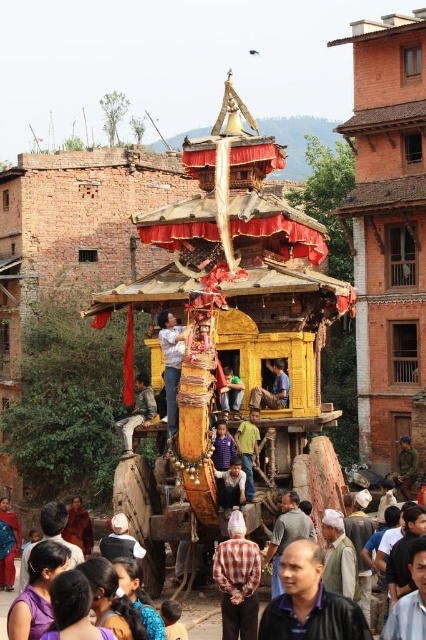
Question: Which point is closer to the camera taking this photo?

Choices:
 (A) (88, 534)
 (B) (256, 456)
 (C) (296, 499)
 (D) (239, 577)

Answer: (D)

Question: Which of these objects is positioned closest to the wooden pole at center?

Choices:
 (A) brown monk at center
 (B) blue fabric at center
 (C) green fabric shirt at center
 (D) yellow wooden person at center

Answer: (D)

Question: Can you confirm if brown monk at center is positioned to the right of green fabric at center?

Choices:
 (A) no
 (B) yes

Answer: (A)

Question: Is wooden bench at center to the right of light brown wooden person at center from the viewer's perspective?

Choices:
 (A) no
 (B) yes

Answer: (A)

Question: Can you confirm if checkered fabric shirt at center is positioned above wooden bench at center?

Choices:
 (A) yes
 (B) no

Answer: (B)

Question: Which point is farther from the camera taking this photo?

Choices:
 (A) (77, 508)
 (B) (245, 461)

Answer: (A)